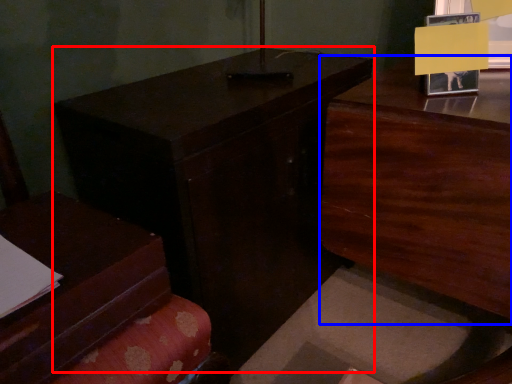
Question: Among these objects, which one is farthest to the camera, table (highlighted by a red box) or dresser (highlighted by a blue box)?

Choices:
 (A) table
 (B) dresser

Answer: (A)